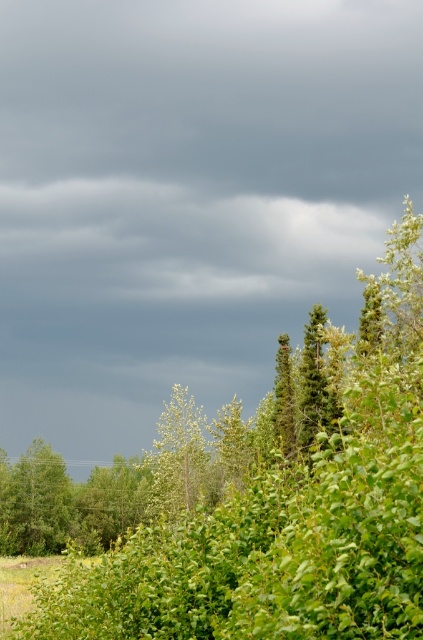
You are a bird looking for a nesting spot. You see two trees in the image, the green leafy tree at lower left and the green leafy tree at center. Which tree would you choose if you prefer a smaller tree for nesting?

The green leafy tree at lower left has a smaller size compared to the green leafy tree at center, so you would choose the green leafy tree at lower left for nesting.

Looking at this image, you are standing in the middle of the forest and see the green leafy tree at upper center and the green leafy tree at lower left. Which tree is closer to you?

The green leafy tree at upper center is closer to you because it is in front of the green leafy tree at lower left.

Looking at this image, you are standing in a forest clearing and see the green leafy tree at upper center. If you want to take a photo of it with your camera, which has a maximum focus range of 6 meters, will you be able to capture it clearly?

The green leafy tree at upper center is 6.10 meters from camera, which exceeds the camera maximum focus range of 6 meters. Therefore, you won